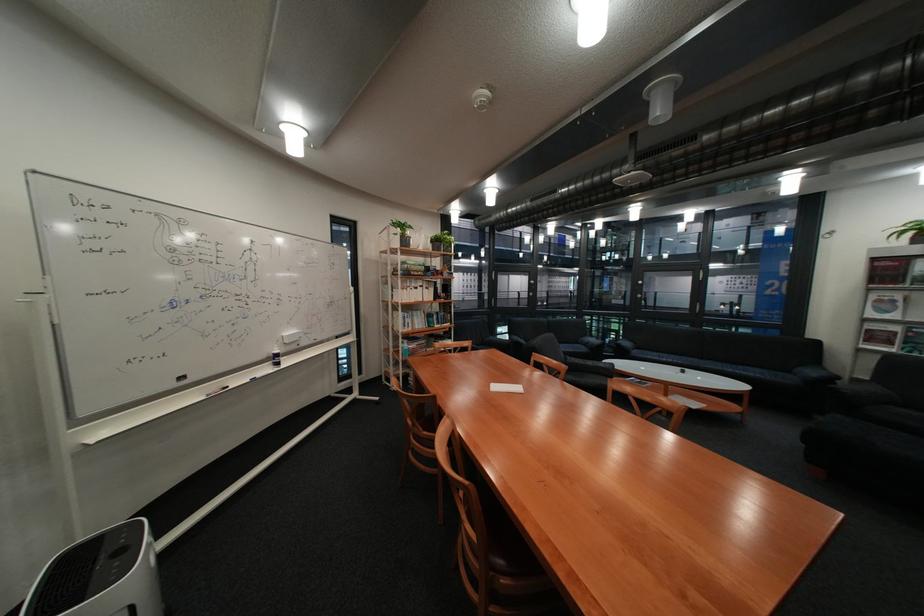
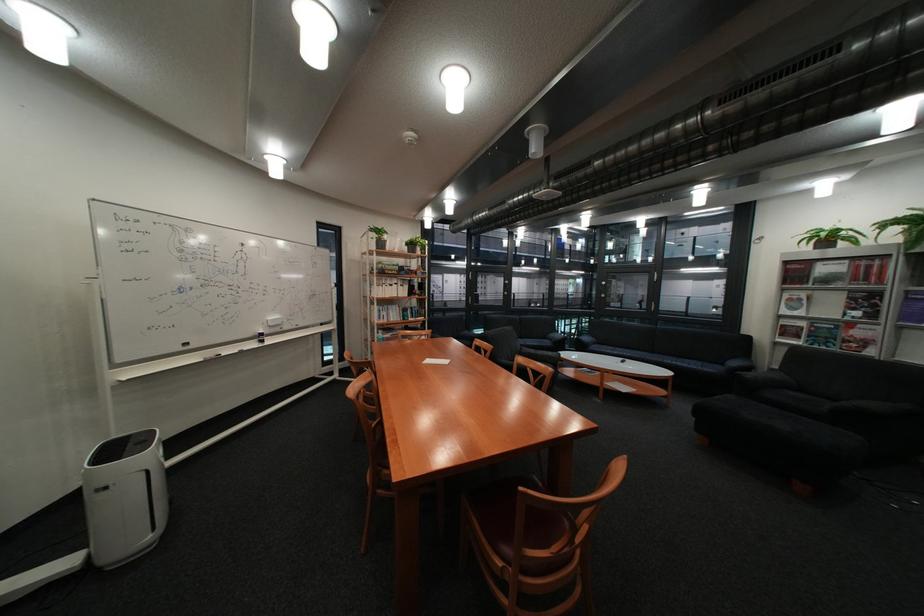
The point at [299,334] is marked in the first image. Where is the corresponding point in the second image?

(284, 318)